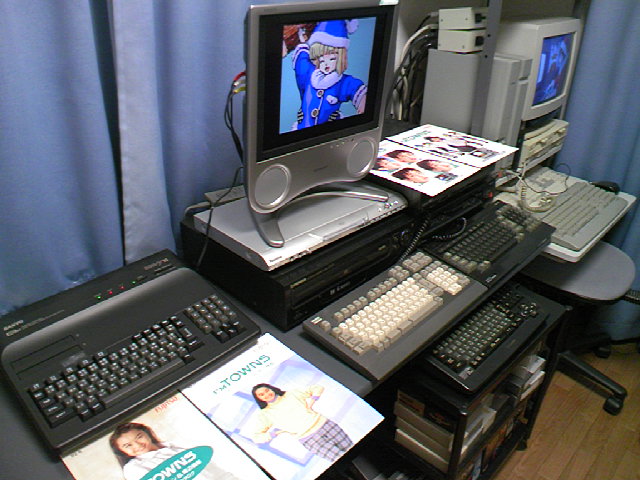
The image size is (640, 480). What are the coordinates of `speaker` in the screenshot? It's located at (271, 192), (355, 168).